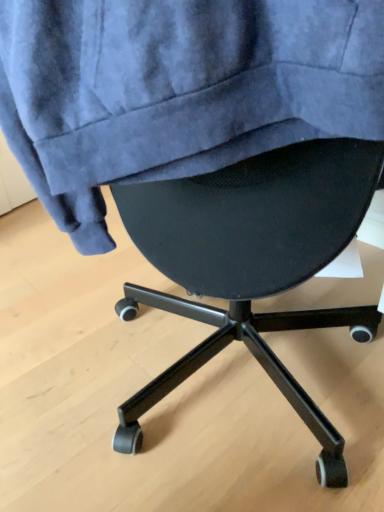
Where is `blank space above black mesh chair at center (from a real-world perspective)`? The image size is (384, 512). blank space above black mesh chair at center (from a real-world perspective) is located at coordinates (116, 346).